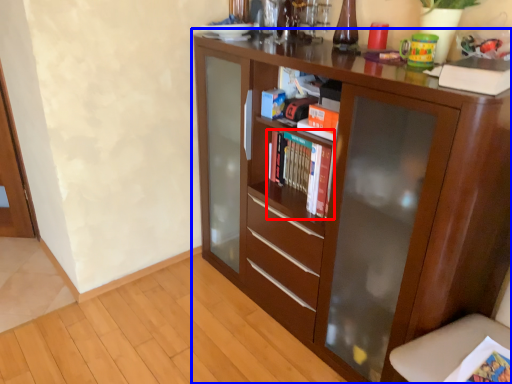
Question: Which object appears farthest to the camera in this image, book (highlighted by a red box) or cupboard (highlighted by a blue box)?

Choices:
 (A) book
 (B) cupboard

Answer: (A)